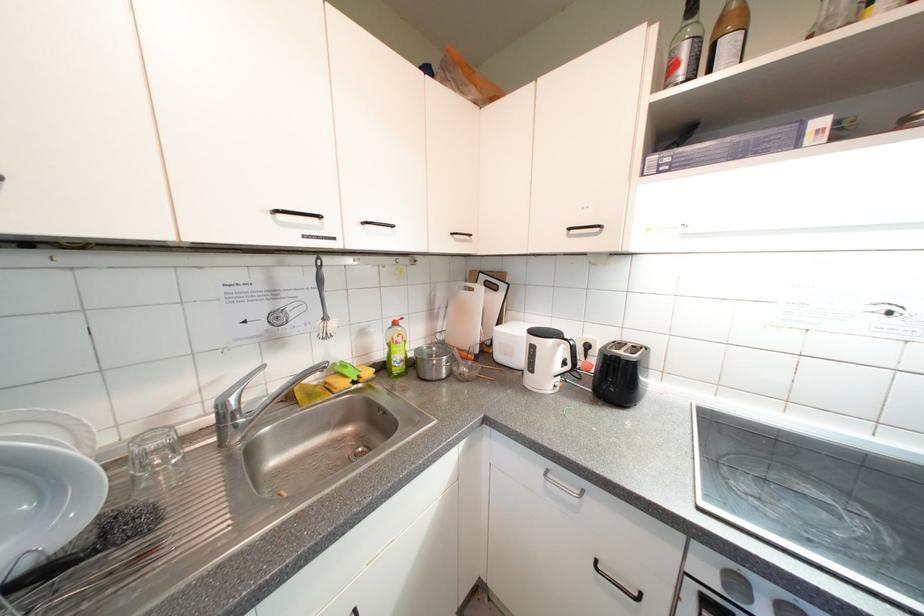
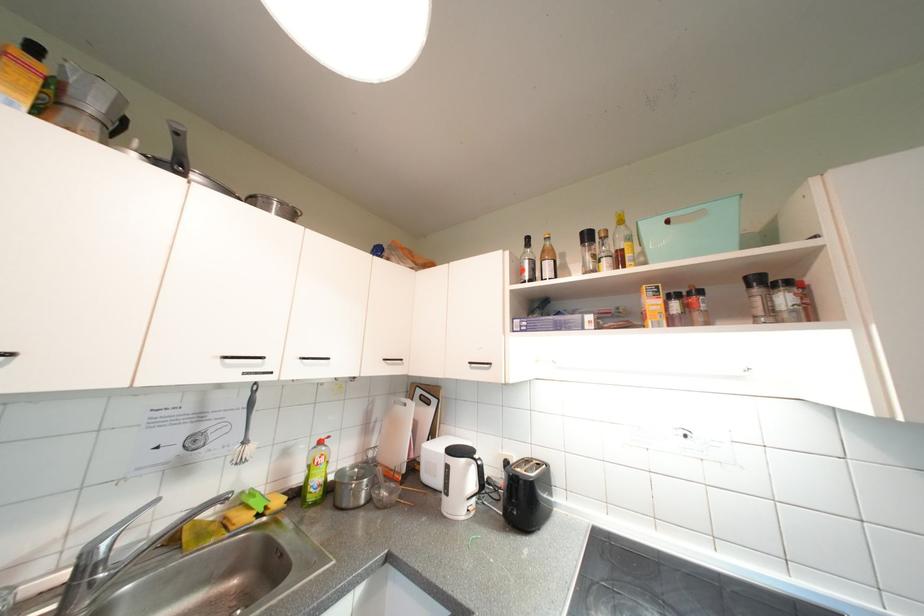
From the picture: In a continuous first-person perspective shot, in which direction is the camera moving?

The cameraman walked toward right, backward.